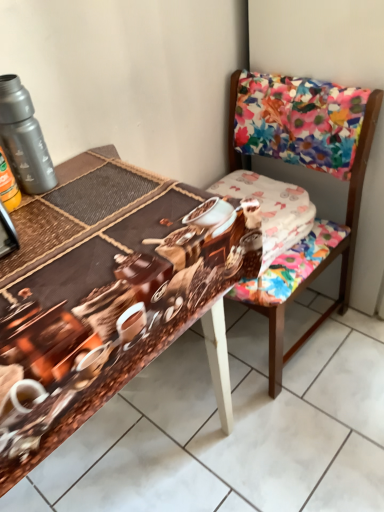
Locate an element on the screen. The image size is (384, 512). vacant region to the right of metallic gray thermos at upper left is located at coordinates (101, 180).